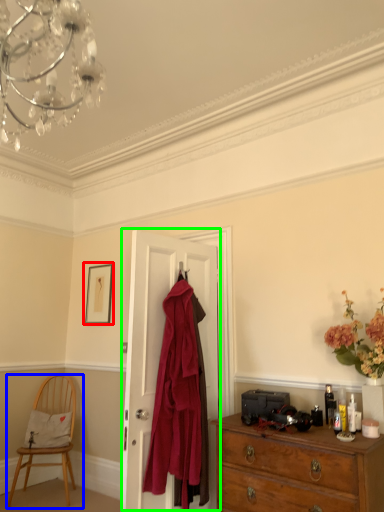
Question: Which object is positioned closest to picture frame (highlighted by a red box)? Select from chair (highlighted by a blue box) and door (highlighted by a green box).

Choices:
 (A) chair
 (B) door

Answer: (A)